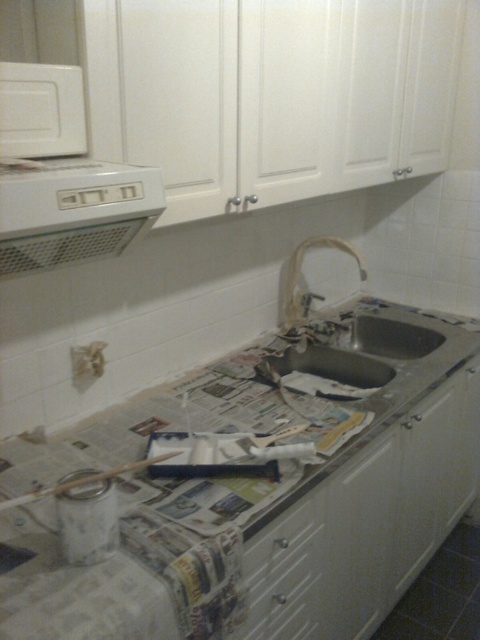
Does white plastic exhaust hood at upper left come behind white glossy drawer at lower center?

No.

Is white plastic exhaust hood at upper left above white glossy drawer at lower center?

Yes.

Does point (139, 221) lie behind point (245, 632)?

No, (139, 221) is in front of (245, 632).

I want to click on white plastic exhaust hood at upper left, so click(x=72, y=211).

Does point (266, 582) come farther from viewer compared to point (317, 356)?

No, it is not.

You are a GUI agent. You are given a task and a screenshot of the screen. Output one action in this format:
    pyautogui.click(x=<x>, y=<y>)
    Task: Click on the white glossy drawer at lower center
    
    Given the screenshot: What is the action you would take?
    [285, 573]

Does white glossy countertop at center appear over white glossy drawer at lower center?

Correct, white glossy countertop at center is located above white glossy drawer at lower center.

What do you see at coordinates (264, 493) in the screenshot?
I see `white glossy countertop at center` at bounding box center [264, 493].

Is point (168, 483) closer to viewer compared to point (274, 630)?

That is True.

Where is `white glossy countertop at center`? The image size is (480, 640). white glossy countertop at center is located at coordinates (264, 493).